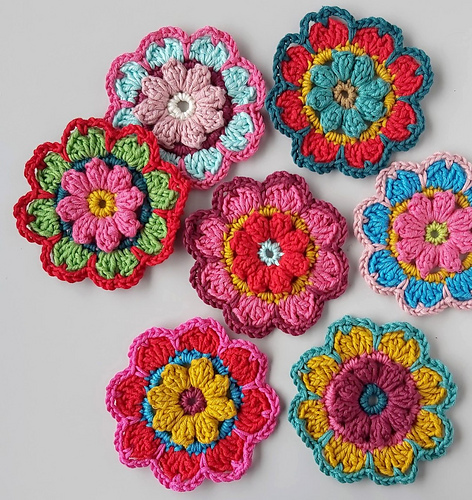
What are the coordinates of `art` in the screenshot? It's located at [401, 420].